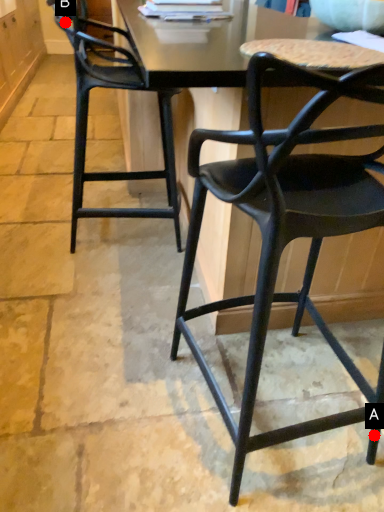
Question: Two points are circled on the image, labeled by A and B beside each circle. Which point is closer to the camera?

Choices:
 (A) A is closer
 (B) B is closer

Answer: (A)